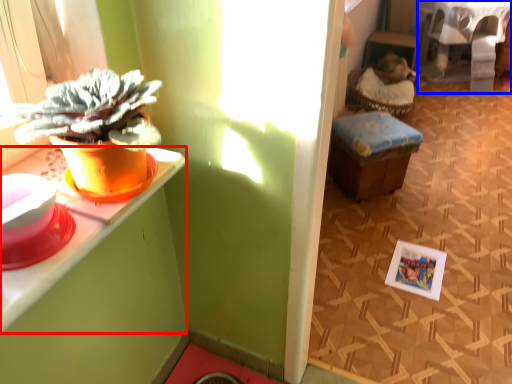
Question: Which object is closer to the camera taking this photo, desk (highlighted by a red box) or table (highlighted by a blue box)?

Choices:
 (A) desk
 (B) table

Answer: (A)